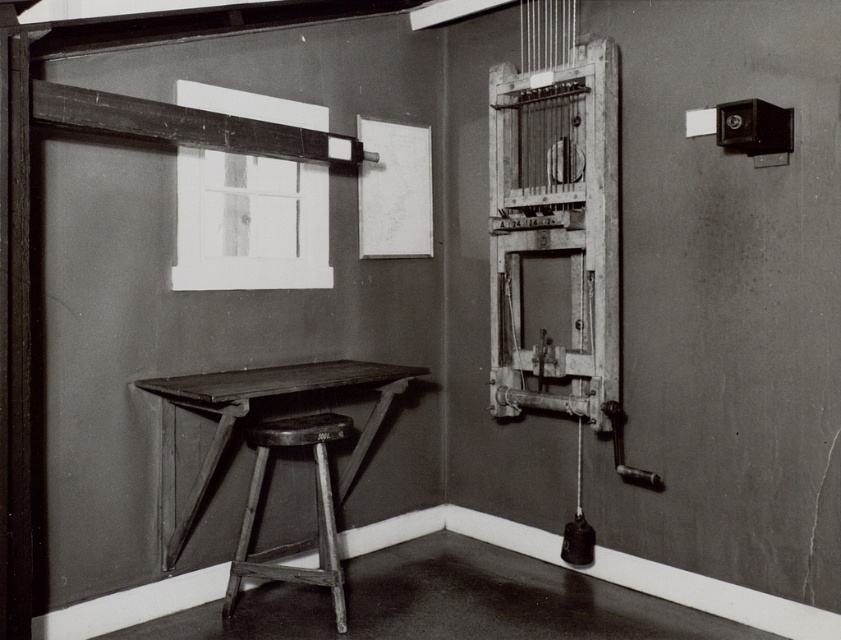
Does wooden/crude wooden cage at right have a larger size compared to wooden stool at lower left?

Correct, wooden/crude wooden cage at right is larger in size than wooden stool at lower left.

Does wooden/crude wooden cage at right have a lesser width compared to wooden stool at lower left?

Yes, wooden/crude wooden cage at right is thinner than wooden stool at lower left.

Is point (524, 355) farther from viewer compared to point (297, 422)?

Yes, it is behind point (297, 422).

The height and width of the screenshot is (640, 841). Find the location of `wooden/crude wooden cage at right`. wooden/crude wooden cage at right is located at coordinates (554, 228).

Is wooden/crude wooden cage at right thinner than white matte window at upper center?

Yes.

Does wooden/crude wooden cage at right have a larger size compared to white matte window at upper center?

Actually, wooden/crude wooden cage at right might be smaller than white matte window at upper center.

Where is `wooden/crude wooden cage at right`? This screenshot has height=640, width=841. wooden/crude wooden cage at right is located at coordinates (554, 228).

Which is below, white matte window at upper center or wooden table at lower left?

Positioned lower is wooden table at lower left.

Does point (283, 269) come in front of point (198, 392)?

No.

Locate an element on the screen. This screenshot has height=640, width=841. white matte window at upper center is located at coordinates (249, 221).